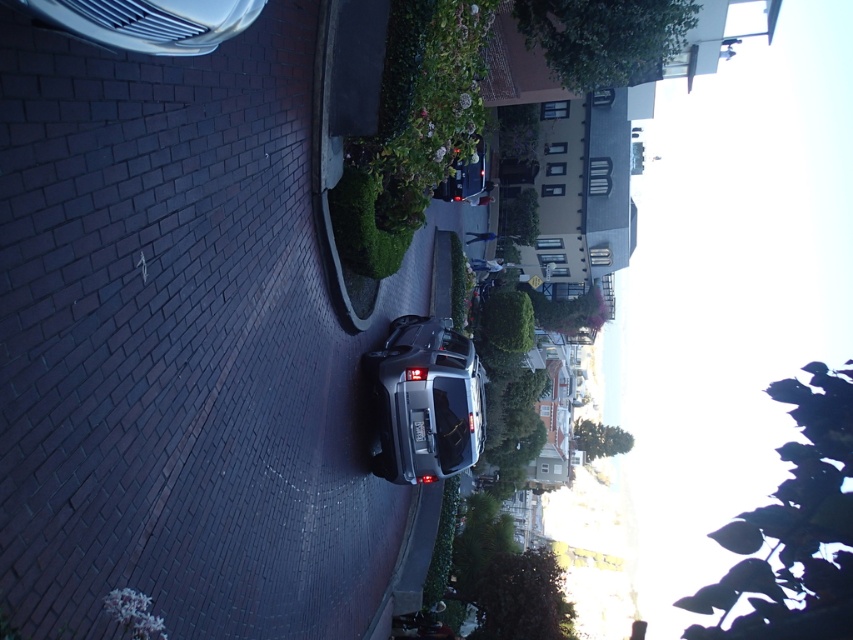
Question: Which object is closer to the camera taking this photo?

Choices:
 (A) satin black suv at center
 (B) silver metallic car at upper left

Answer: (B)

Question: Which point is farther from the camera taking this photo?

Choices:
 (A) (448, 452)
 (B) (30, 0)

Answer: (A)

Question: Does satin black suv at center appear under silver metallic car at upper left?

Choices:
 (A) no
 (B) yes

Answer: (B)

Question: Is satin black suv at center thinner than silver metallic car at upper left?

Choices:
 (A) yes
 (B) no

Answer: (B)

Question: From the image, what is the correct spatial relationship of satin black suv at center in relation to silver metallic car at upper left?

Choices:
 (A) above
 (B) below

Answer: (B)